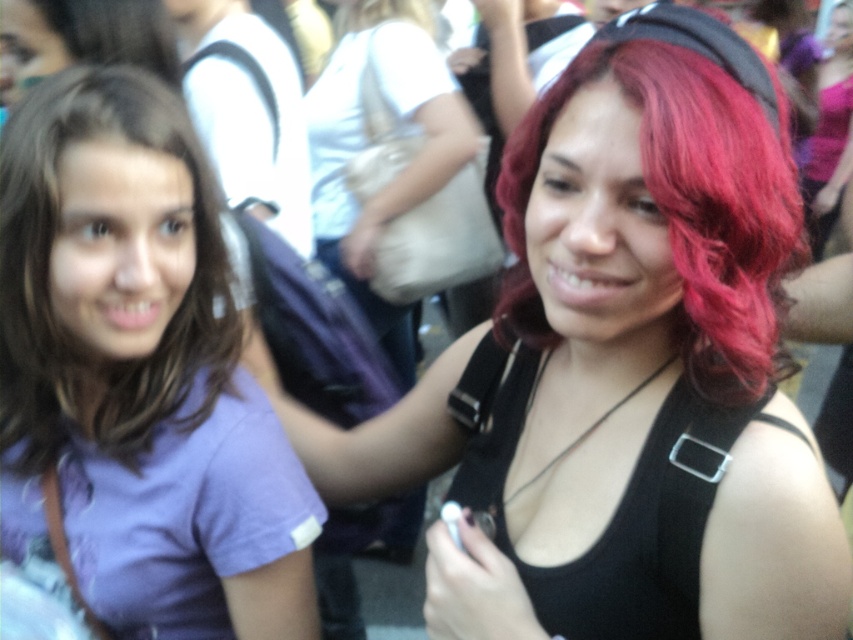
Is shiny red hair at center thinner than purple cotton shirt at left?

No.

Which is below, shiny red hair at center or purple cotton shirt at left?

shiny red hair at center is below.

Who is more forward, (772, 483) or (79, 401)?

Positioned in front is point (772, 483).

Identify the location of shiny red hair at center. The width and height of the screenshot is (853, 640). (621, 371).

Describe the element at coordinates (137, 376) in the screenshot. Image resolution: width=853 pixels, height=640 pixels. I see `purple cotton shirt at left` at that location.

Who is positioned more to the left, purple cotton shirt at left or vivid red hair at center?

purple cotton shirt at left is more to the left.

What do you see at coordinates (137, 376) in the screenshot? This screenshot has width=853, height=640. I see `purple cotton shirt at left` at bounding box center [137, 376].

The image size is (853, 640). Identify the location of purple cotton shirt at left. (137, 376).

Between shiny red hair at center and vivid red hair at center, which one has less height?

vivid red hair at center

Locate an element on the screen. The image size is (853, 640). shiny red hair at center is located at coordinates (621, 371).

Find the location of a particular element. This screenshot has width=853, height=640. shiny red hair at center is located at coordinates (621, 371).